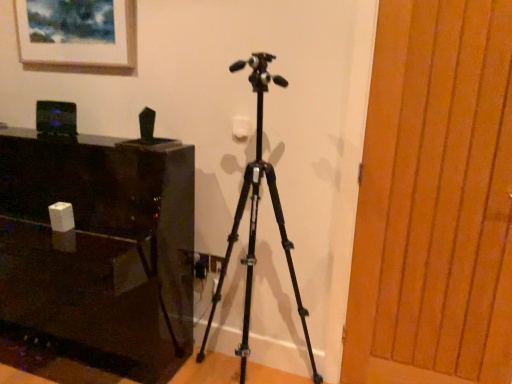
This screenshot has height=384, width=512. Identify the location of empty space that is ontop of wooden door at right (from a real-world perspective). (440, 0).